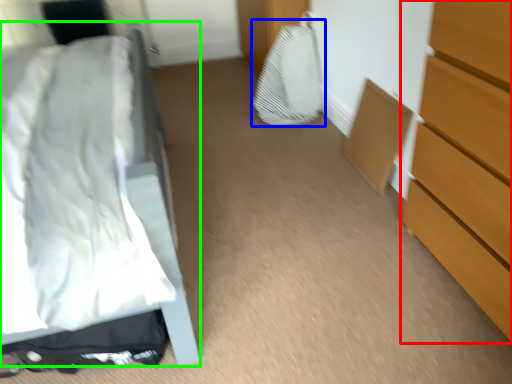
Question: Based on their relative distances, which object is nearer to chest of drawers (highlighted by a red box)? Choose from sheet (highlighted by a blue box) and bed (highlighted by a green box).

Choices:
 (A) sheet
 (B) bed

Answer: (B)